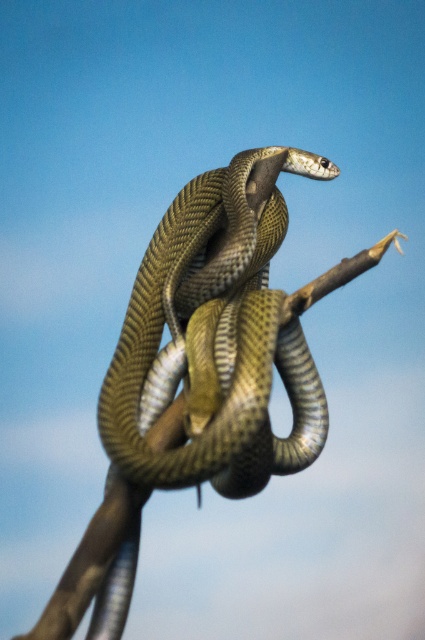
Who is more distant from viewer, (229, 291) or (53, 620)?

Positioned behind is point (229, 291).

Is point (187, 298) farther from viewer compared to point (70, 595)?

That is True.

You are a GUI agent. You are given a task and a screenshot of the screen. Output one action in this format:
    pyautogui.click(x=<x>, y=<y>)
    Task: Click on the shiny green snake at center
    The width and height of the screenshot is (425, 640).
    Given the screenshot: What is the action you would take?
    pyautogui.click(x=215, y=337)